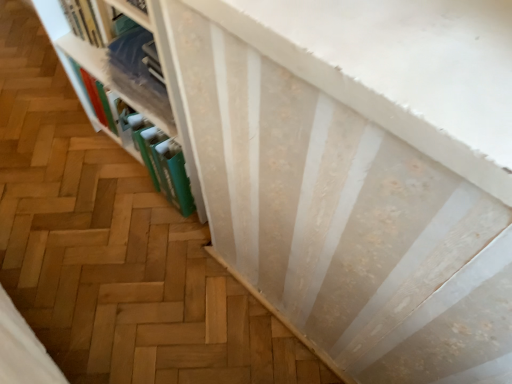
Question: Should I look upward or downward to see white textured bookshelf at upper left?

Choices:
 (A) up
 (B) down

Answer: (A)